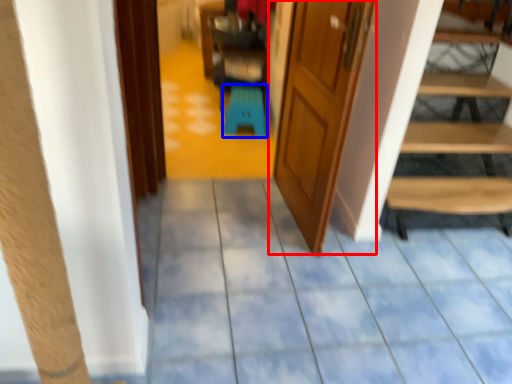
Question: Which object appears closest to the camera in this image, door (highlighted by a red box) or stool (highlighted by a blue box)?

Choices:
 (A) door
 (B) stool

Answer: (A)